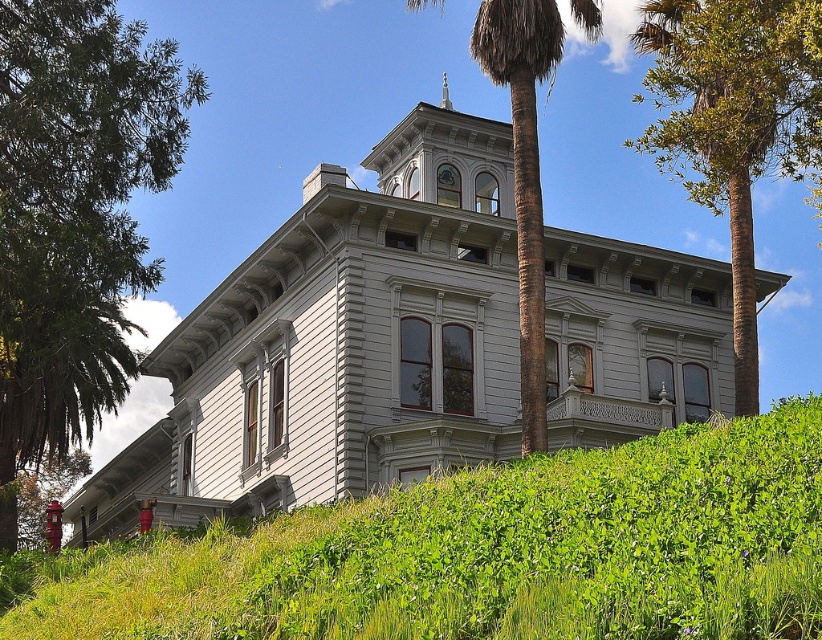
Question: Can you confirm if green leafy palm at center is positioned below silver metallic spire at upper center?

Choices:
 (A) no
 (B) yes

Answer: (B)

Question: Which of the following is the closest to the observer?

Choices:
 (A) green leafy palm at center
 (B) green leafy grass at lower center

Answer: (B)

Question: Is green leafy grass at lower center below green leafy palm at center?

Choices:
 (A) no
 (B) yes

Answer: (B)

Question: Does green leafy palm at center have a larger size compared to brown textured palm tree at upper center?

Choices:
 (A) yes
 (B) no

Answer: (A)

Question: Which of the following is the farthest from the observer?

Choices:
 (A) green leafy tree at left
 (B) silver metallic spire at upper center
 (C) green leafy palm at center
 (D) brown textured palm tree at upper center

Answer: (B)

Question: Which point is farther to the camera?

Choices:
 (A) (760, 628)
 (B) (439, 104)

Answer: (B)